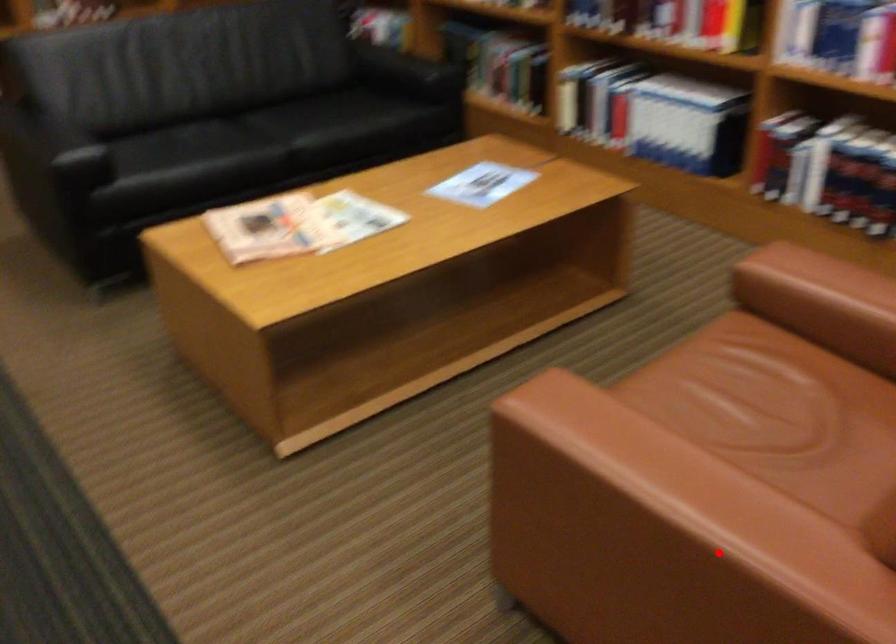
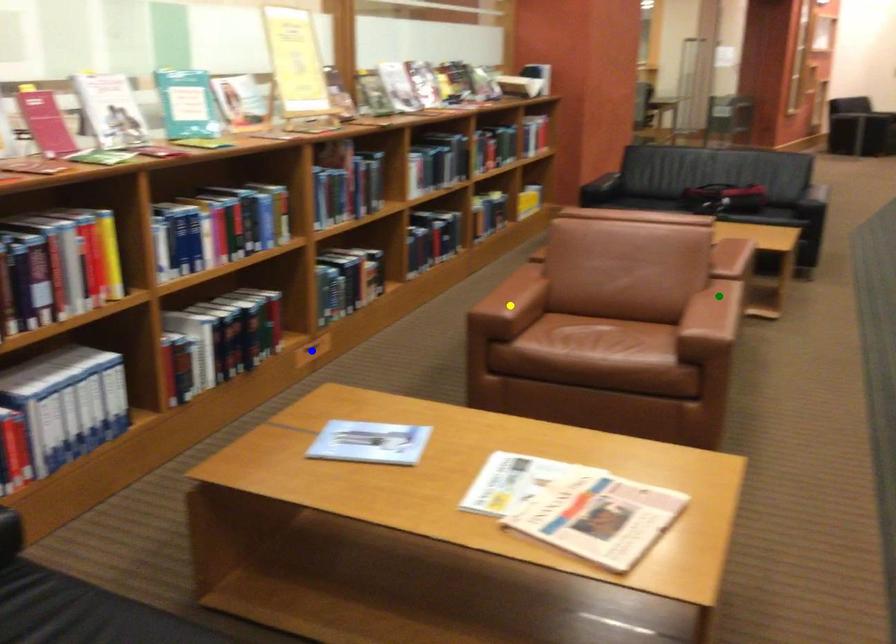
Question: I am providing you with two images of the same scene from different viewpoints. A red point is marked on the first image. You are given multiple points on the second image. Can you choose the point in image 2 that corresponds to the point in image 1?

Choices:
 (A) blue point
 (B) green point
 (C) yellow point

Answer: (B)